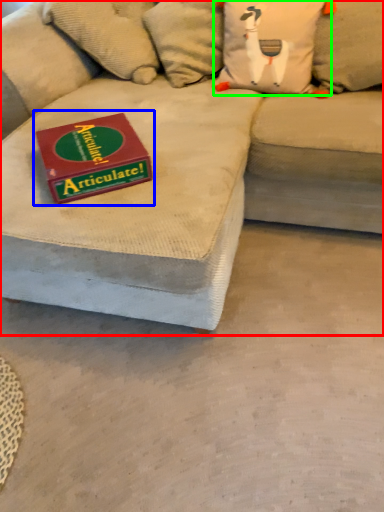
Question: Which is farther away from studio couch (highlighted by a red box)? paperback book (highlighted by a blue box) or pillow (highlighted by a green box)?

Choices:
 (A) paperback book
 (B) pillow

Answer: (B)